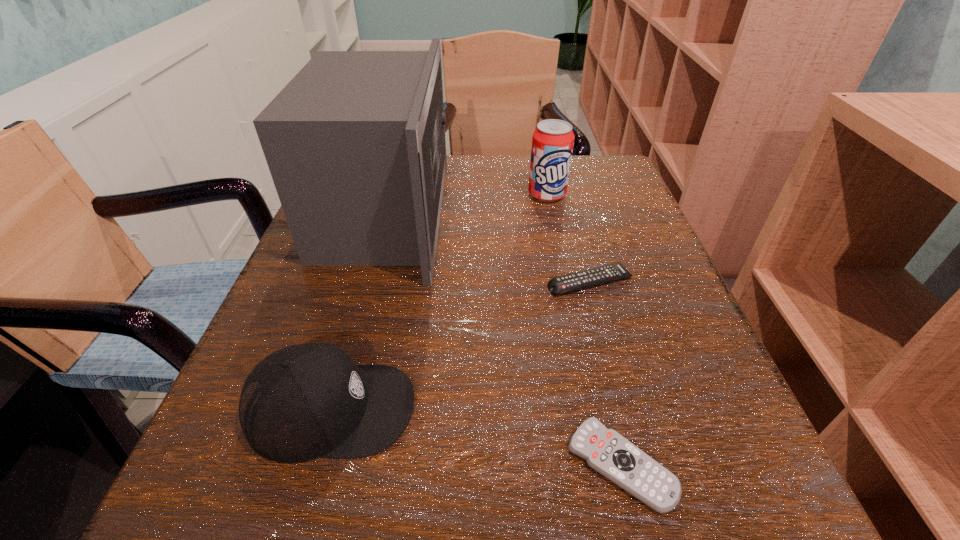
Find the location of `microwave oven`. microwave oven is located at coordinates (355, 143).

At what (x,y) coordinates should I click in order to perform the action: click on soda can. Please return your answer as a coordinate pair (x, y). Looking at the image, I should click on (552, 142).

This screenshot has width=960, height=540. I want to click on cap, so click(305, 401).

Where is `the farther remote control`? the farther remote control is located at coordinates (571, 282).

At what (x,y) coordinates should I click in order to perform the action: click on the shorter remote control. Please return your answer as a coordinate pair (x, y). This screenshot has height=540, width=960. Looking at the image, I should click on (606, 451).

The height and width of the screenshot is (540, 960). I want to click on the nearer remote control, so click(606, 451).

Locate an element on the screen. The width and height of the screenshot is (960, 540). vacant space situated 0.350m on the front-facing side of the tallest object is located at coordinates (614, 213).

In order to click on vacant area situated on the surface of the soda can in this screenshot , I will do `click(561, 260)`.

The height and width of the screenshot is (540, 960). In order to click on free spot located on the front-facing side of the third shortest object in this screenshot , I will do (522, 409).

Locate an element on the screen. The image size is (960, 540). vacant space located 0.370m on the left of the farther remote control is located at coordinates (329, 282).